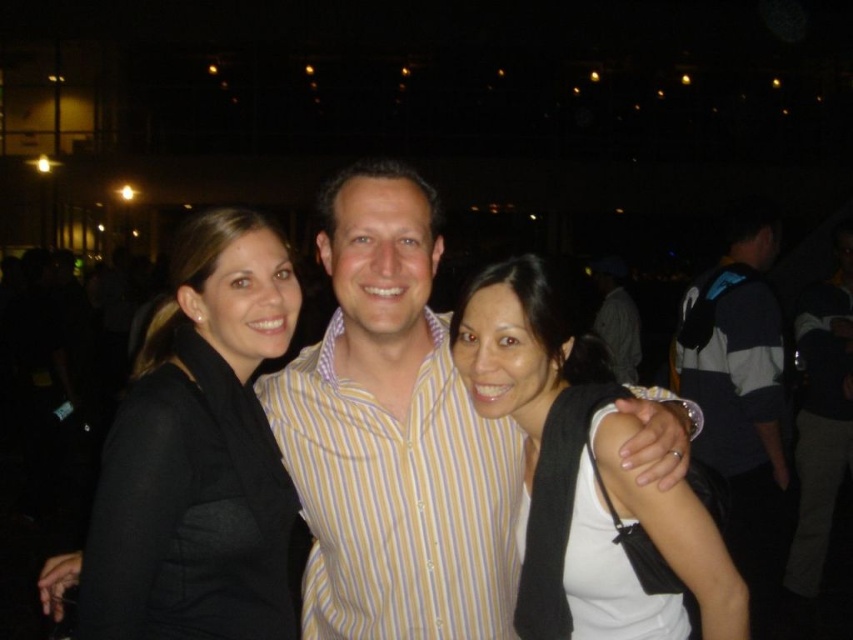
Can you confirm if black fabric at center is positioned to the right of yellow striped shirt at center?

No, black fabric at center is not to the right of yellow striped shirt at center.

Consider the image. Is black fabric at center to the left of yellow striped shirt at center from the viewer's perspective?

Yes, black fabric at center is to the left of yellow striped shirt at center.

Who is more forward, (326, 554) or (498, 602)?

Positioned in front is point (498, 602).

The width and height of the screenshot is (853, 640). In order to click on black fabric at center in this screenshot , I will do `click(393, 435)`.

Does point (363, 260) come behind point (763, 556)?

No, it is in front of (763, 556).

Does point (358, 324) lie in front of point (732, 378)?

Yes, it is.

Measure the distance between black fabric at center and camera.

1.61 meters

I want to click on black fabric at center, so click(393, 435).

Between black matte blazer at left and gray/white striped shirt at right, which one is positioned higher?

black matte blazer at left

Who is more forward, (173, 401) or (695, 444)?

Positioned in front is point (173, 401).

The image size is (853, 640). What do you see at coordinates (198, 454) in the screenshot?
I see `black matte blazer at left` at bounding box center [198, 454].

The image size is (853, 640). What are the coordinates of `black matte blazer at left` in the screenshot? It's located at (198, 454).